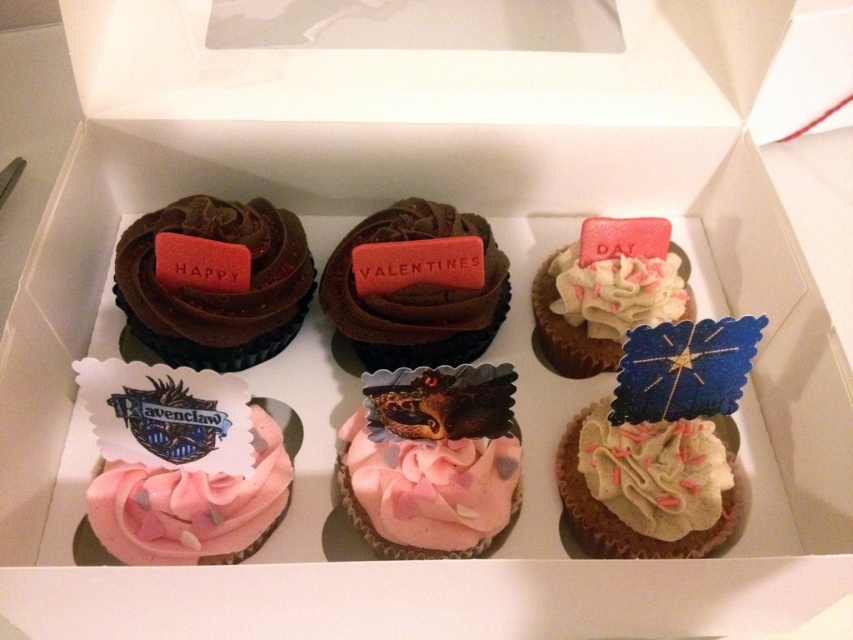
Is chocolate matte cupcake at upper left shorter than matte white cupcake at upper right?

Incorrect, chocolate matte cupcake at upper left's height does not fall short of matte white cupcake at upper right's.

Can you confirm if chocolate matte cupcake at upper left is thinner than matte white cupcake at upper right?

Incorrect, chocolate matte cupcake at upper left's width is not less than matte white cupcake at upper right's.

Is point (183, 225) positioned after point (643, 234)?

No, (183, 225) is in front of (643, 234).

Where is `chocolate matte cupcake at upper left`? This screenshot has width=853, height=640. chocolate matte cupcake at upper left is located at coordinates click(x=216, y=292).

Describe the element at coordinates (432, 460) in the screenshot. Image resolution: width=853 pixels, height=640 pixels. I see `pink frosted cupcake with heart sprinkles at center` at that location.

Describe the element at coordinates (432, 460) in the screenshot. The height and width of the screenshot is (640, 853). I see `pink frosted cupcake with heart sprinkles at center` at that location.

Where is `pink frosted cupcake with heart sprinkles at center`? This screenshot has width=853, height=640. pink frosted cupcake with heart sprinkles at center is located at coordinates (x=432, y=460).

Can you confirm if chocolate matte valentine's day sign at center is positioned below white frosted cupcake with sprinkles at center?

Incorrect, chocolate matte valentine's day sign at center is not positioned below white frosted cupcake with sprinkles at center.

Between point (376, 365) and point (563, 458), which one is positioned in front?

Point (563, 458)

The width and height of the screenshot is (853, 640). Describe the element at coordinates (416, 292) in the screenshot. I see `chocolate matte valentine's day sign at center` at that location.

I want to click on chocolate matte valentine's day sign at center, so click(x=416, y=292).